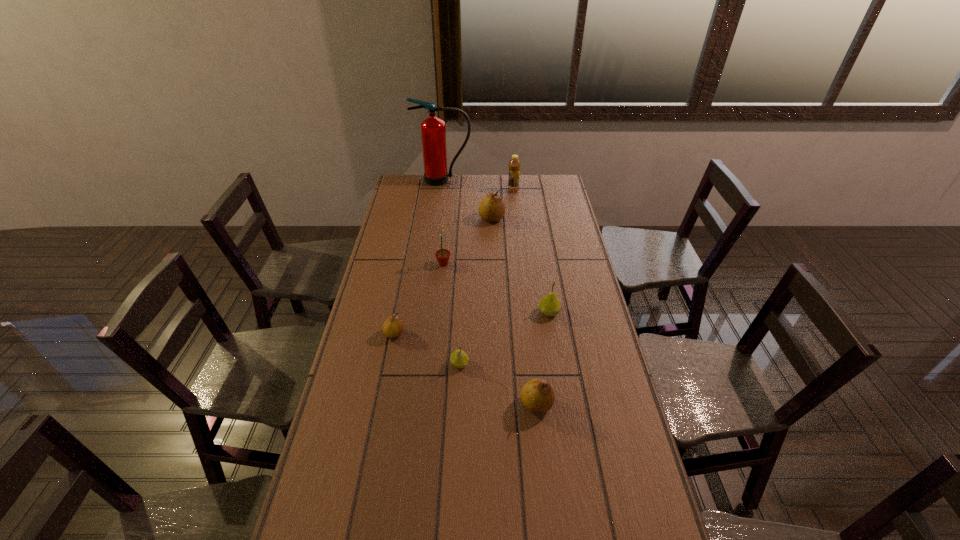
Identify the location of vacant area at the left edge. (404, 217).

The height and width of the screenshot is (540, 960). Find the location of `vacant space at the right edge of the desktop`. vacant space at the right edge of the desktop is located at coordinates (566, 317).

This screenshot has width=960, height=540. In order to click on vacant space at the far left corner of the desktop in this screenshot , I will do `click(408, 189)`.

The height and width of the screenshot is (540, 960). In order to click on free spot between the tallest object and the sunflower in this screenshot , I will do `click(444, 222)`.

Image resolution: width=960 pixels, height=540 pixels. I want to click on free spot between the tallest object and the bottle, so click(478, 185).

The height and width of the screenshot is (540, 960). Find the location of `vacant area that lies between the right green pear and the sunflower`. vacant area that lies between the right green pear and the sunflower is located at coordinates (x=496, y=288).

Identify the location of free space that is in between the second nearest brown pear and the bottle. The width and height of the screenshot is (960, 540). (454, 262).

This screenshot has width=960, height=540. In order to click on vacant space in between the farther green pear and the sunflower in this screenshot , I will do `click(496, 288)`.

Where is `free point between the second nearest pear and the fire extinguisher`? Image resolution: width=960 pixels, height=540 pixels. free point between the second nearest pear and the fire extinguisher is located at coordinates (451, 272).

You are a GUI agent. You are given a task and a screenshot of the screen. Output one action in this format:
    pyautogui.click(x=<x>, y=<y>)
    Task: Click on the second closest object to the farthest brown pear
    This screenshot has height=540, width=960.
    Given the screenshot: What is the action you would take?
    (433, 131)